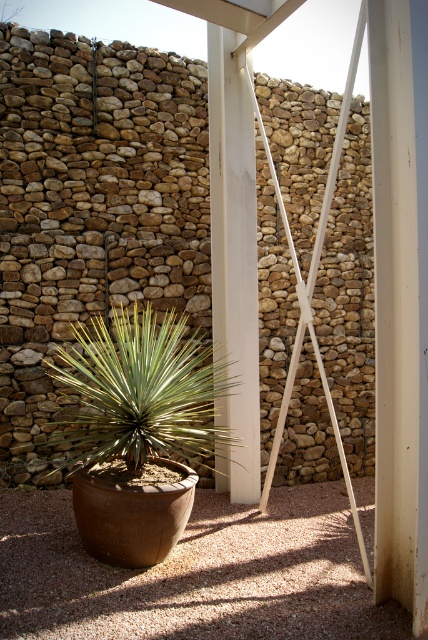
Question: Which of these objects is positioned closest to the white smooth pillar at right?

Choices:
 (A) white smooth pillar at center
 (B) brown gravel at lower center
 (C) green leafy plant at center
 (D) brown textured stone at center

Answer: (B)

Question: Which object is closer to the camera taking this photo?

Choices:
 (A) white smooth pillar at center
 (B) brown textured stone at center
 (C) white smooth pillar at right

Answer: (C)

Question: Does white smooth pillar at right have a greater width compared to green leafy plant at center?

Choices:
 (A) yes
 (B) no

Answer: (B)

Question: Is brown textured stone at center to the right of green leafy plant at center from the viewer's perspective?

Choices:
 (A) yes
 (B) no

Answer: (B)

Question: Is white smooth pillar at right wider than green leafy plant at center?

Choices:
 (A) no
 (B) yes

Answer: (A)

Question: Which object appears closest to the camera in this image?

Choices:
 (A) brown gravel at lower center
 (B) brown textured stone at center
 (C) white smooth pillar at center

Answer: (A)